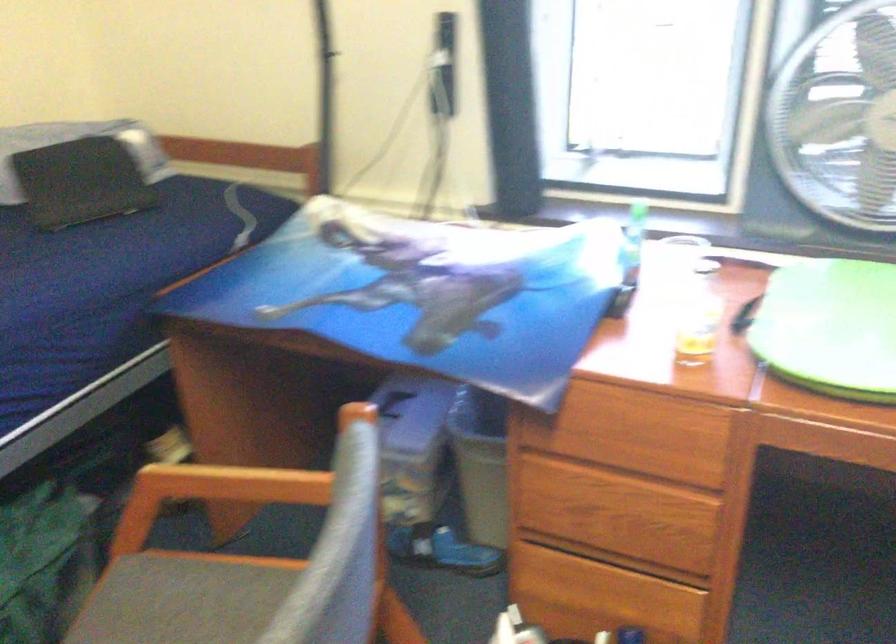
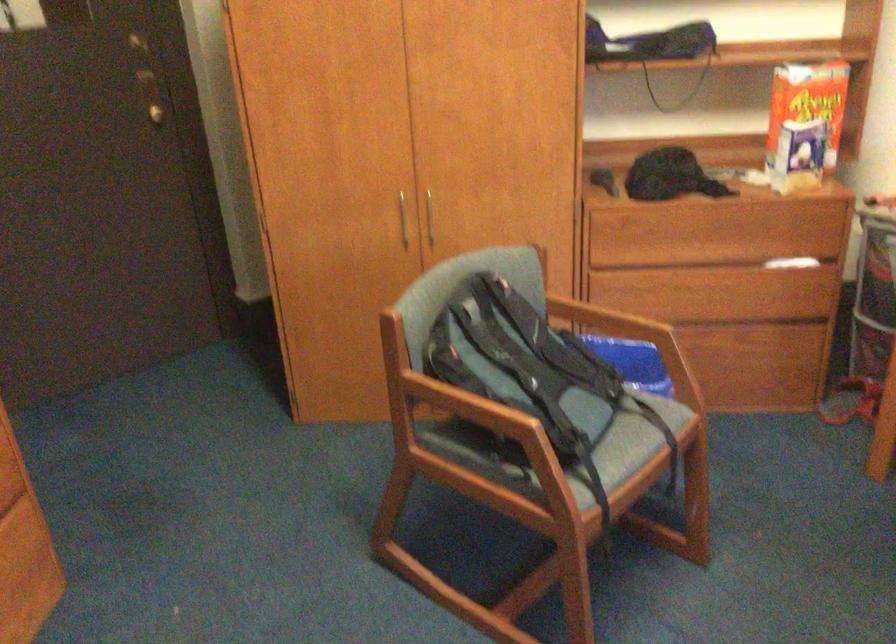
How did the camera likely rotate?

The camera's rotation is toward left-down.